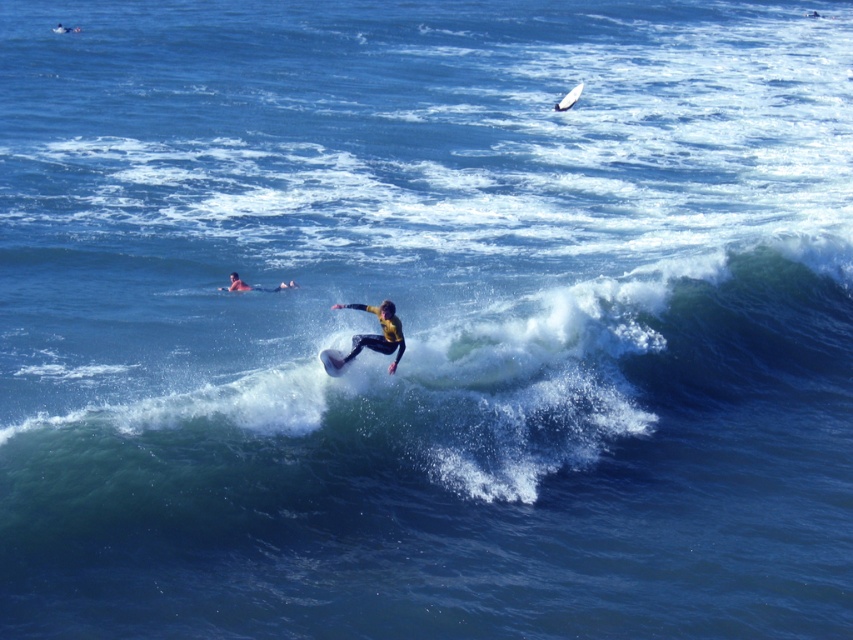
Based on the photo, which is above, yellow matte surfboard at center or white foam surfboard at upper right?

white foam surfboard at upper right is above.

Is yellow matte surfboard at center taller than white foam surfboard at upper right?

No.

At what (x,y) coordinates should I click in order to perform the action: click on yellow matte surfboard at center. Please return your answer as a coordinate pair (x, y). This screenshot has height=640, width=853. Looking at the image, I should click on (376, 333).

You are a GUI agent. You are given a task and a screenshot of the screen. Output one action in this format:
    pyautogui.click(x=<x>, y=<y>)
    Task: Click on the yellow matte surfboard at center
    The image size is (853, 640).
    Given the screenshot: What is the action you would take?
    pyautogui.click(x=376, y=333)

Can you confirm if smooth skin person at upper left is wider than white foam surfboard at upper right?

No.

Where is `smooth skin person at upper left`? The height and width of the screenshot is (640, 853). smooth skin person at upper left is located at coordinates (254, 285).

The image size is (853, 640). What do you see at coordinates (332, 362) in the screenshot? I see `white foam surfboard at center` at bounding box center [332, 362].

Does point (320, 355) lie in front of point (277, 284)?

Yes, point (320, 355) is in front of point (277, 284).

What are the coordinates of `white foam surfboard at center` in the screenshot? It's located at (332, 362).